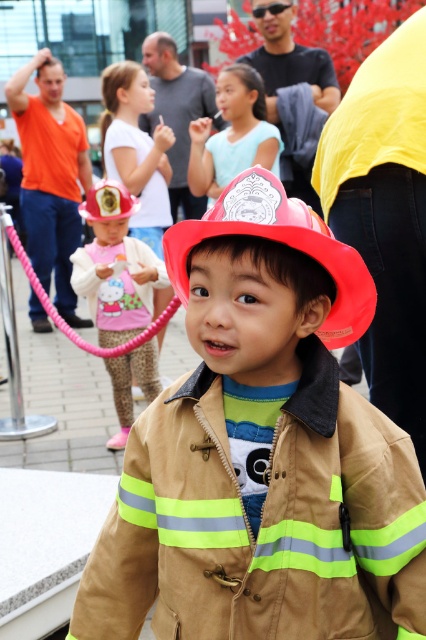
Question: Which point is farther to the camera?

Choices:
 (A) matte plastic fire helmet at center
 (B) matte pink helmet at center
 (C) matte red helmet at center
 (D) matte brown fireman at left

Answer: (D)

Question: Does matte red helmet at center have a smaller size compared to shiny red helmet at center?

Choices:
 (A) yes
 (B) no

Answer: (B)

Question: Can you confirm if matte brown fireman at left is bigger than shiny red helmet at center?

Choices:
 (A) no
 (B) yes

Answer: (B)

Question: Does matte pink helmet at center have a smaller size compared to matte plastic fireman at center?

Choices:
 (A) no
 (B) yes

Answer: (B)

Question: Which point is farther to the camera?

Choices:
 (A) matte plastic fireman at center
 (B) shiny red helmet at center
 (C) matte brown fireman at left

Answer: (C)

Question: Which object is positioned farthest from the matte brown fireman at left?

Choices:
 (A) matte red helmet at center
 (B) matte pink helmet at center

Answer: (A)